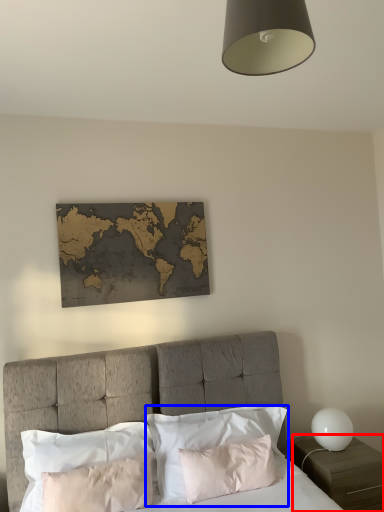
Question: Which object appears farthest to the camera in this image, nightstand (highlighted by a red box) or pillow (highlighted by a blue box)?

Choices:
 (A) nightstand
 (B) pillow

Answer: (A)